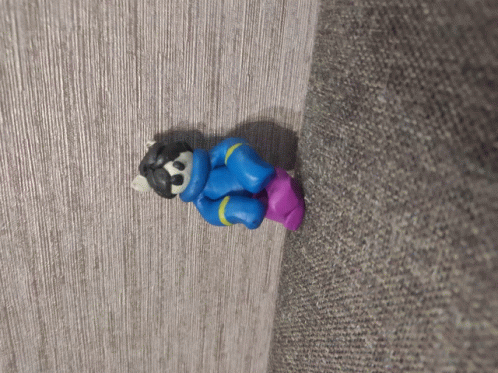
In order to click on wall in this screenshot , I will do `click(161, 302)`.